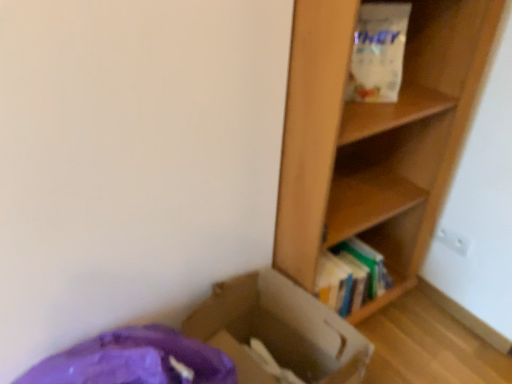
Question: Is the position of wooden bookshelf at right more distant than that of cardboard box at lower left?

Choices:
 (A) yes
 (B) no

Answer: (A)

Question: Is wooden bookshelf at right bigger than cardboard box at lower left?

Choices:
 (A) yes
 (B) no

Answer: (B)

Question: Considering the relative sizes of wooden bookshelf at right and cardboard box at lower left in the image provided, is wooden bookshelf at right taller than cardboard box at lower left?

Choices:
 (A) yes
 (B) no

Answer: (B)

Question: From the image's perspective, is wooden bookshelf at right beneath cardboard box at lower left?

Choices:
 (A) yes
 (B) no

Answer: (B)

Question: Is wooden bookshelf at right positioned far away from cardboard box at lower left?

Choices:
 (A) no
 (B) yes

Answer: (A)

Question: Is the position of wooden bookshelf at right less distant than that of cardboard box at lower left?

Choices:
 (A) yes
 (B) no

Answer: (B)

Question: Is wooden bookshelf at right to the right of white matte paper bag at upper right from the viewer's perspective?

Choices:
 (A) no
 (B) yes

Answer: (A)

Question: Can you confirm if wooden bookshelf at right is positioned to the left of white matte paper bag at upper right?

Choices:
 (A) yes
 (B) no

Answer: (A)

Question: From the image's perspective, is wooden bookshelf at right located above white matte paper bag at upper right?

Choices:
 (A) no
 (B) yes

Answer: (A)

Question: Is wooden bookshelf at right shorter than white matte paper bag at upper right?

Choices:
 (A) yes
 (B) no

Answer: (A)

Question: Could you tell me if wooden bookshelf at right is turned towards white matte paper bag at upper right?

Choices:
 (A) no
 (B) yes

Answer: (A)

Question: From a real-world perspective, does wooden bookshelf at right sit lower than white matte paper bag at upper right?

Choices:
 (A) yes
 (B) no

Answer: (A)

Question: Is white matte paper bag at upper right taller than cardboard box at lower left?

Choices:
 (A) yes
 (B) no

Answer: (B)